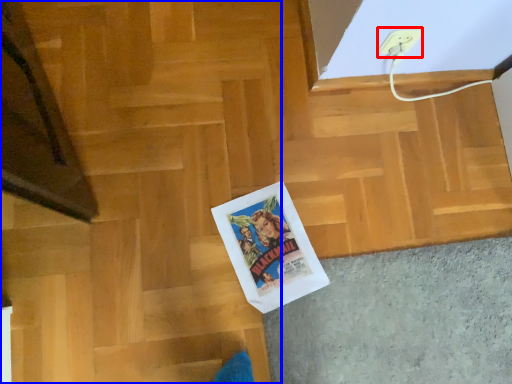
Question: Which point is closer to the camera, electric outlet (highlighted by a red box) or stairwell (highlighted by a blue box)?

Choices:
 (A) electric outlet
 (B) stairwell

Answer: (B)